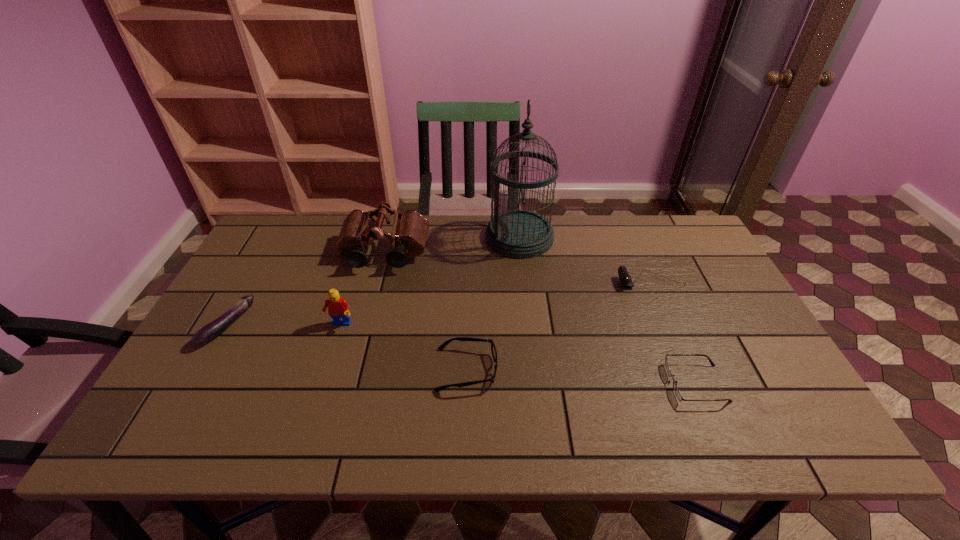
Where is `the tallest object`? The image size is (960, 540). the tallest object is located at coordinates (513, 233).

Find the location of a particular element. binoculars is located at coordinates (409, 233).

This screenshot has height=540, width=960. Find the location of `Lego`. Lego is located at coordinates (338, 308).

Where is `webcam`? webcam is located at coordinates (625, 279).

Find the location of `eggplant`. eggplant is located at coordinates (213, 329).

This screenshot has height=540, width=960. I want to click on the taller spectacles, so click(x=493, y=349).

This screenshot has width=960, height=540. Identify the location of the shortest object. (676, 390).

Where is `the right spectacles`? This screenshot has height=540, width=960. the right spectacles is located at coordinates (676, 390).

Locate an element on the screen. The image size is (960, 540). vacant region located on the front-facing side of the tallest object is located at coordinates (419, 237).

Identify the location of vacant region located on the front-facing side of the tallest object. The height and width of the screenshot is (540, 960). pos(389,237).